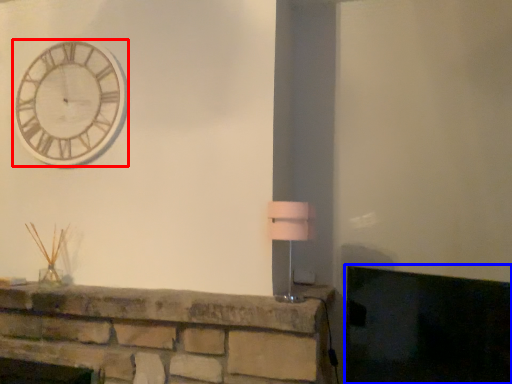
Question: Which point is further to the camera, wall clock (highlighted by a red box) or fireplace (highlighted by a blue box)?

Choices:
 (A) wall clock
 (B) fireplace

Answer: (A)